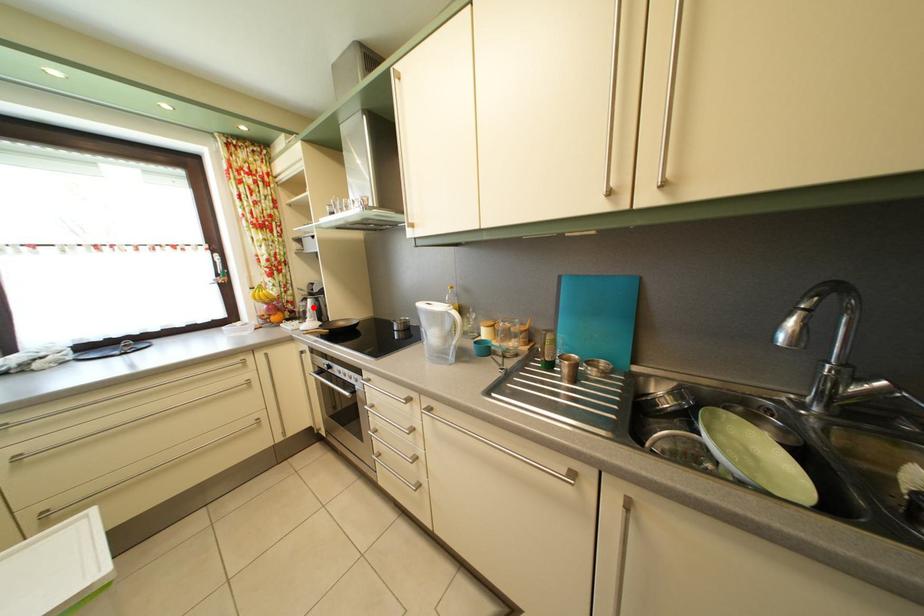
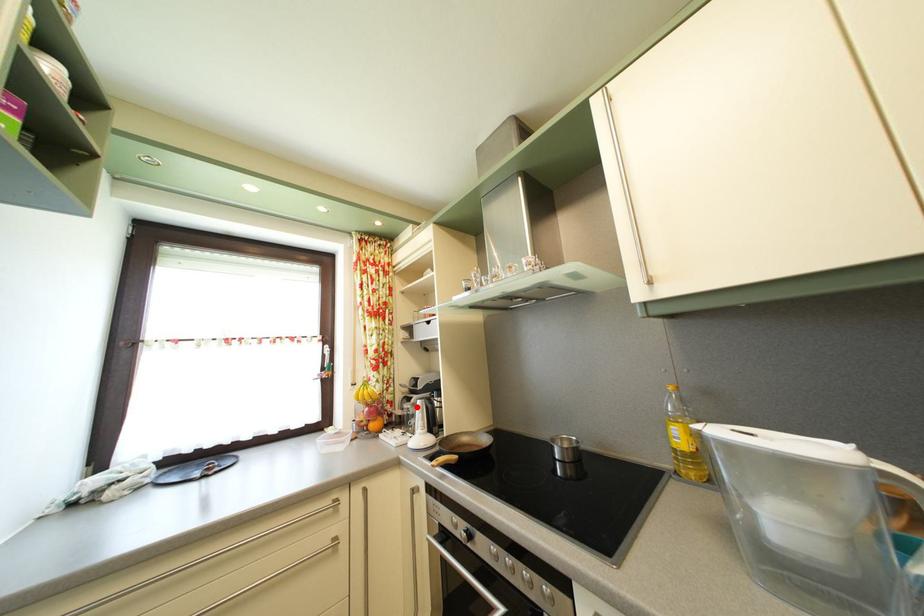
I am providing you with two images of the same scene from different viewpoints. A red point is marked on the first image and another point is marked on the second image. Is the red point in image1 aligned with the point shown in image2?

Yes